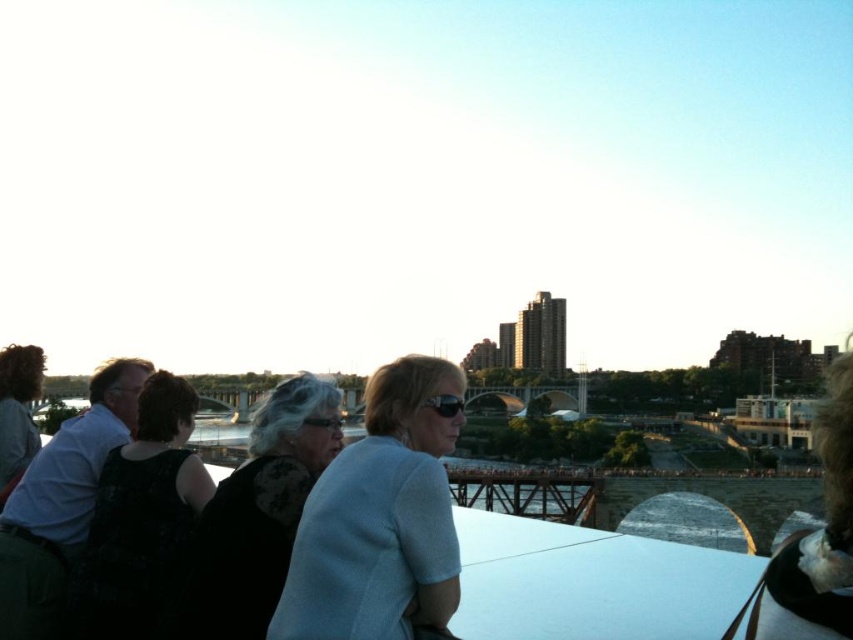
Question: In this image, where is black plastic goggles at center located relative to clear plastic goggles at center?

Choices:
 (A) above
 (B) below

Answer: (A)

Question: From the image, what is the correct spatial relationship of light blue fabric at center in relation to clear plastic goggles at center?

Choices:
 (A) above
 (B) below

Answer: (B)

Question: Which of the following is the closest to the observer?

Choices:
 (A) (277, 394)
 (B) (306, 422)

Answer: (B)

Question: Which point is farther from the camera taking this photo?

Choices:
 (A) (114, 518)
 (B) (216, 548)
 (C) (422, 401)
 (D) (410, 412)

Answer: (C)

Question: Which point is closer to the camera?

Choices:
 (A) black fabric dress at left
 (B) black plastic goggles at center
 (C) light blue fabric at center
 (D) black textured dress at center

Answer: (C)

Question: Can you confirm if light blue fabric at center is positioned above black plastic goggles at center?

Choices:
 (A) no
 (B) yes

Answer: (A)